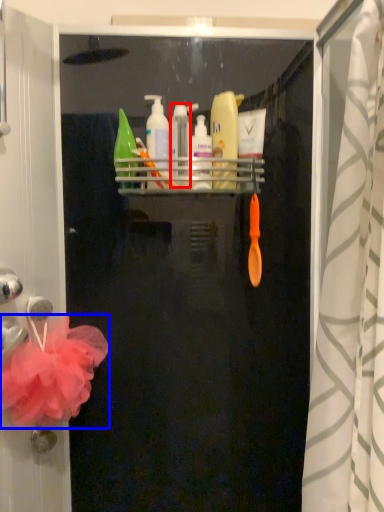
Question: Which of the following is the farthest to the observer, toiletry (highlighted by a red box) or bath towel (highlighted by a blue box)?

Choices:
 (A) toiletry
 (B) bath towel

Answer: (A)